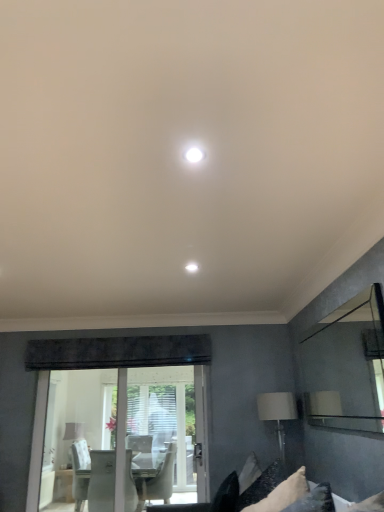
Measure the distance between point (303, 471) and camera.

Point (303, 471) and camera are 8.59 feet apart.

What do you see at coordinates (277, 413) in the screenshot?
I see `white fabric lampshade at lower right, the 1th table lamp from the front` at bounding box center [277, 413].

Measure the distance between white fabric table lamp at lower left, placed as the 1th table lamp when sorted from back to front, and camera.

They are 5.84 meters apart.

The width and height of the screenshot is (384, 512). In order to click on white fabric pillow at lower right in this screenshot , I will do `click(281, 494)`.

From the image's perspective, who appears lower, white fabric table lamp at lower left, which is counted as the 1th table lamp, starting from the left, or white glossy light fixture at center?

white fabric table lamp at lower left, which is counted as the 1th table lamp, starting from the left, appears lower in the image.

Between white fabric table lamp at lower left, which appears as the second table lamp when viewed from the front, and white glossy light fixture at center, which one has more height?

With more height is white fabric table lamp at lower left, which appears as the second table lamp when viewed from the front.

Between white fabric table lamp at lower left, which appears as the 2th table lamp when viewed from the right, and white glossy light fixture at center, which one has larger width?

white fabric table lamp at lower left, which appears as the 2th table lamp when viewed from the right.

Is white glossy light fixture at center inside white fabric table lamp at lower left, which appears as the 2th table lamp when viewed from the right?

No.

Which is less distant, (199,150) or (63,455)?

Point (199,150)

Do you think white glossy light fixture at center is within white fabric table lamp at lower left, the first table lamp ordered from the bottom, or outside of it?

white glossy light fixture at center exists outside the volume of white fabric table lamp at lower left, the first table lamp ordered from the bottom.

Looking at this image, how many degrees apart are the facing directions of white glossy light fixture at center and white fabric table lamp at lower left, placed as the 1th table lamp when sorted from back to front?

The facing directions of white glossy light fixture at center and white fabric table lamp at lower left, placed as the 1th table lamp when sorted from back to front, are 89.2 degrees apart.

Between white glossy light fixture at center and white fabric table lamp at lower left, which appears as the 2th table lamp when viewed from the right, which one is positioned behind?

Positioned behind is white fabric table lamp at lower left, which appears as the 2th table lamp when viewed from the right.

What are the coordinates of `lighting above the clear glass mirror at right (from a real-world perspective)` in the screenshot? It's located at (194, 154).

Is clear glass mirror at right bigger or smaller than white glossy light fixture at center?

Clearly, clear glass mirror at right is larger in size than white glossy light fixture at center.

Between clear glass mirror at right and white glossy light fixture at center, which one has smaller width?

clear glass mirror at right is thinner.

What's the angular difference between clear glass mirror at right and white glossy light fixture at center's facing directions?

0.749 degrees.

Who is shorter, white fabric pillow at lower right or white fabric table lamp at lower left, which appears as the 2th table lamp when viewed from the right?

Standing shorter between the two is white fabric pillow at lower right.

From the image's perspective, is white fabric pillow at lower right located above or below white fabric table lamp at lower left, which appears as the 2th table lamp when viewed from the right?

white fabric pillow at lower right is situated higher than white fabric table lamp at lower left, which appears as the 2th table lamp when viewed from the right, in the image.

Which of these two, white fabric pillow at lower right or white fabric table lamp at lower left, acting as the 2th table lamp starting from the top, is wider?

Wider between the two is white fabric pillow at lower right.

Is white fabric pillow at lower right looking in the opposite direction of white fabric table lamp at lower left, the first table lamp ordered from the bottom?

No, white fabric pillow at lower right is not facing away from white fabric table lamp at lower left, the first table lamp ordered from the bottom.

Which point is more distant from viewer, (324, 336) or (276, 497)?

The point (324, 336) is farther.

From a real-world perspective, between clear glass mirror at right and white fabric pillow at lower right, who is vertically lower?

white fabric pillow at lower right, from a real-world perspective.

Considering the sizes of clear glass mirror at right and white fabric pillow at lower right in the image, is clear glass mirror at right wider or thinner than white fabric pillow at lower right?

Considering their sizes, clear glass mirror at right looks slimmer than white fabric pillow at lower right.

From the image's perspective, is clear glass mirror at right on top of white fabric pillow at lower right?

Yes, from the image's perspective, clear glass mirror at right is over white fabric pillow at lower right.

Is white fabric pillow at lower right outside of clear glass mirror at right?

Yes, white fabric pillow at lower right is located beyond the bounds of clear glass mirror at right.

Based on the photo, between white fabric pillow at lower right and clear glass mirror at right, which one appears on the right side from the viewer's perspective?

From the viewer's perspective, clear glass mirror at right appears more on the right side.

Is the depth of white fabric pillow at lower right less than that of clear glass mirror at right?

No.

Considering the relative sizes of white fabric pillow at lower right and clear glass mirror at right in the image provided, is white fabric pillow at lower right wider than clear glass mirror at right?

Yes.

From the image's perspective, is white fabric table lamp at lower left, the first table lamp ordered from the bottom, beneath white fabric lampshade at lower right, marked as the 1th table lamp in a top-to-bottom arrangement?

Yes, from the image's perspective, white fabric table lamp at lower left, the first table lamp ordered from the bottom, is beneath white fabric lampshade at lower right, marked as the 1th table lamp in a top-to-bottom arrangement.

Measure the distance between white fabric table lamp at lower left, the first table lamp ordered from the bottom, and white fabric lampshade at lower right, marked as the 1th table lamp in a top-to-bottom arrangement.

A distance of 10.85 feet exists between white fabric table lamp at lower left, the first table lamp ordered from the bottom, and white fabric lampshade at lower right, marked as the 1th table lamp in a top-to-bottom arrangement.

Can you confirm if white fabric table lamp at lower left, which is counted as the 1th table lamp, starting from the left, is bigger than white fabric lampshade at lower right, the 1th table lamp from the front?

Yes.

In the scene shown: Is white fabric table lamp at lower left, acting as the 2th table lamp starting from the top, spatially inside white fabric lampshade at lower right, which is counted as the second table lamp, starting from the left, or outside of it?

white fabric table lamp at lower left, acting as the 2th table lamp starting from the top, is outside white fabric lampshade at lower right, which is counted as the second table lamp, starting from the left.

Identify the location of lighting located above the white fabric table lamp at lower left, which is counted as the 1th table lamp, starting from the left (from the image's perspective). (194, 154).

The image size is (384, 512). What are the coordinates of `table lamp on the left of white glossy light fixture at center` in the screenshot? It's located at (73, 431).

Consider the image. From the image, which object appears to be nearer to white fabric lampshade at lower right, positioned as the second table lamp in back-to-front order, white fabric table lamp at lower left, which appears as the second table lamp when viewed from the front, or white fabric pillow at lower right?

white fabric pillow at lower right lies closer to white fabric lampshade at lower right, positioned as the second table lamp in back-to-front order, than the other object.

Looking at this image, looking at the image, which one is located further to white fabric pillow at lower right, white fabric table lamp at lower left, which appears as the 2th table lamp when viewed from the right, or white fabric lampshade at lower right, arranged as the second table lamp when ordered from the bottom?

Among the two, white fabric table lamp at lower left, which appears as the 2th table lamp when viewed from the right, is located further to white fabric pillow at lower right.

Which object lies further to the anchor point white glossy light fixture at center, white fabric pillow at lower right or white fabric table lamp at lower left, placed as the 1th table lamp when sorted from back to front?

white fabric table lamp at lower left, placed as the 1th table lamp when sorted from back to front, lies further to white glossy light fixture at center than the other object.

Looking at the image, which one is located closer to white fabric table lamp at lower left, the first table lamp ordered from the bottom, clear glass mirror at right or white fabric pillow at lower right?

clear glass mirror at right lies closer to white fabric table lamp at lower left, the first table lamp ordered from the bottom, than the other object.

From the image, which object appears to be farther from white fabric pillow at lower right, clear glass mirror at right or white fabric lampshade at lower right, positioned as the second table lamp in back-to-front order?

The object further to white fabric pillow at lower right is clear glass mirror at right.

Based on the photo, from the image, which object appears to be nearer to clear glass mirror at right, white fabric pillow at lower right or white fabric lampshade at lower right, which is counted as the second table lamp, starting from the left?

white fabric lampshade at lower right, which is counted as the second table lamp, starting from the left.

Looking at the image, which one is located further to white fabric table lamp at lower left, placed as the 1th table lamp when sorted from back to front, white fabric lampshade at lower right, arranged as the second table lamp when ordered from the bottom, or white fabric pillow at lower right?

Among the two, white fabric pillow at lower right is located further to white fabric table lamp at lower left, placed as the 1th table lamp when sorted from back to front.

Looking at the image, which one is located closer to white fabric lampshade at lower right, which appears as the first table lamp when viewed from the right, white fabric pillow at lower right or clear glass mirror at right?

clear glass mirror at right.

Locate an element on the screen. This screenshot has width=384, height=512. table lamp between white glossy light fixture at center and white fabric table lamp at lower left, which appears as the 2th table lamp when viewed from the right, along the z-axis is located at coordinates (277, 413).

Where is `pillow between white glossy light fixture at center and white fabric lampshade at lower right, positioned as the second table lamp in back-to-front order, in the vertical direction`? pillow between white glossy light fixture at center and white fabric lampshade at lower right, positioned as the second table lamp in back-to-front order, in the vertical direction is located at coordinates (281, 494).

In order to click on mirror between white glossy light fixture at center and white fabric pillow at lower right from top to bottom in this screenshot , I will do `click(347, 366)`.

At what (x,y) coordinates should I click in order to perform the action: click on table lamp between white fabric pillow at lower right and white fabric table lamp at lower left, placed as the 1th table lamp when sorted from back to front, in the front-back direction. Please return your answer as a coordinate pair (x, y). Looking at the image, I should click on (277, 413).